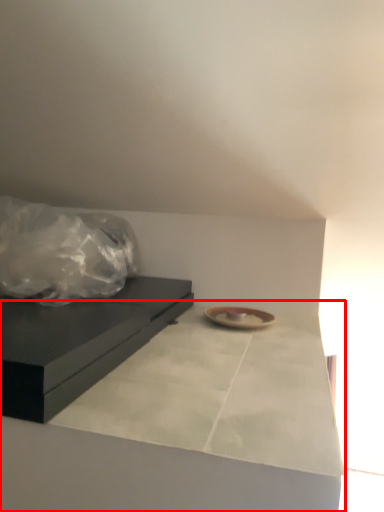
Question: From the image, what is the correct spatial relationship of counter top (annotated by the red box) in relation to table?

Choices:
 (A) right
 (B) left

Answer: (A)